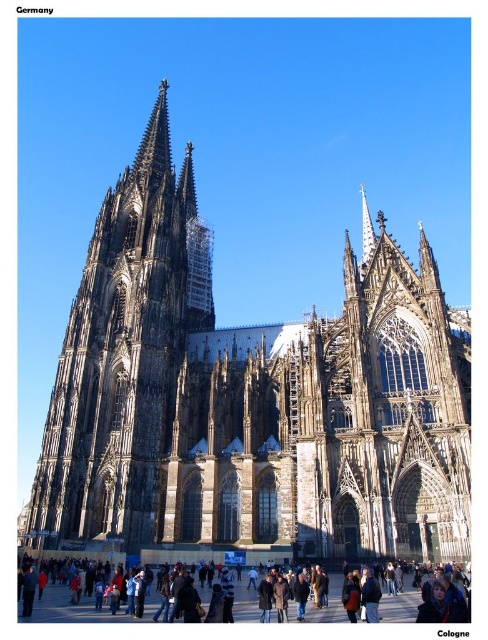
Who is shorter, dark gray stone church at center or dark brown leather jacket at lower center?

dark brown leather jacket at lower center

Image resolution: width=488 pixels, height=640 pixels. What do you see at coordinates (249, 400) in the screenshot? I see `dark gray stone church at center` at bounding box center [249, 400].

The width and height of the screenshot is (488, 640). Identify the location of dark gray stone church at center. (249, 400).

Which is below, dark gray stone church at center or dark gray stone tower at left?

Positioned lower is dark gray stone church at center.

Is dark gray stone church at center positioned in front of dark gray stone tower at left?

Yes.

Between point (171, 536) and point (151, 438), which one is positioned in front?

Point (171, 536) is more forward.

Where is `dark gray stone church at center`? This screenshot has width=488, height=640. dark gray stone church at center is located at coordinates (249, 400).

Who is positioned more to the right, dark gray stone tower at left or dark brown leather jacket at lower center?

dark brown leather jacket at lower center

Which is behind, point (116, 218) or point (104, 616)?

The point (116, 218) is more distant.

Between point (87, 372) and point (156, 605), which one is positioned behind?

The point (87, 372) is behind.

Find the location of a particular element. This screenshot has width=488, height=640. dark gray stone tower at left is located at coordinates (123, 356).